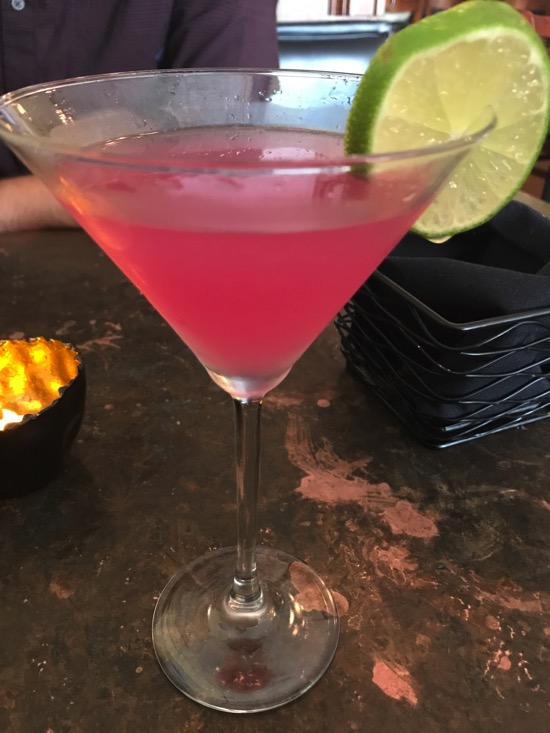
Where is `martini glass`? The image size is (550, 733). martini glass is located at coordinates (273, 303), (258, 196), (246, 563), (251, 627).